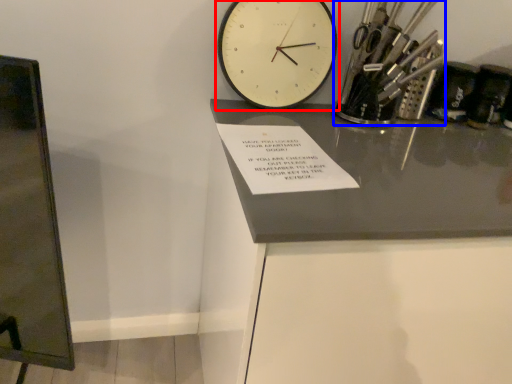
Question: Which of the following is the farthest to the observer, wall clock (highlighted by a red box) or stationery (highlighted by a blue box)?

Choices:
 (A) wall clock
 (B) stationery

Answer: (B)